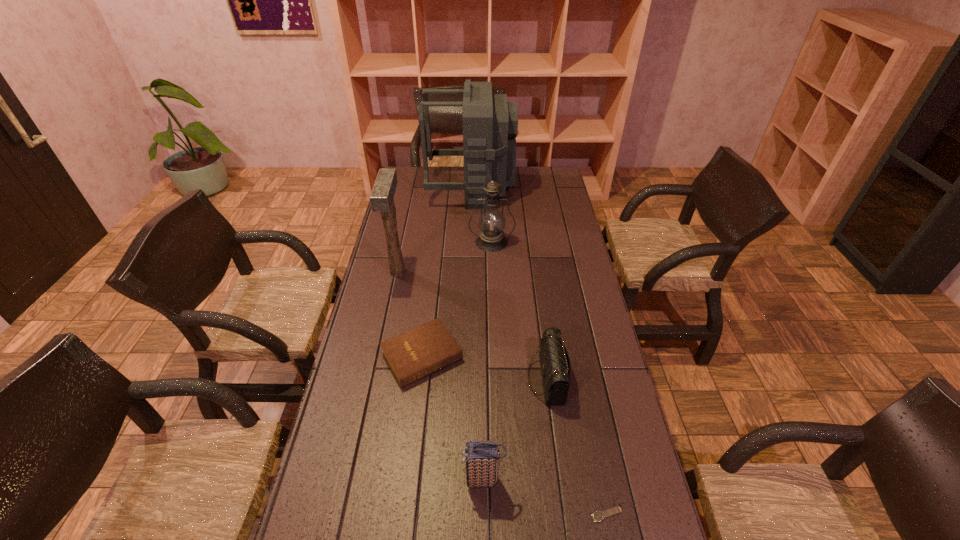
This screenshot has height=540, width=960. Find the location of `empty location between the nearer clutch bag and the second shortest object`. empty location between the nearer clutch bag and the second shortest object is located at coordinates pyautogui.click(x=453, y=418).

In order to click on blank region between the third shortest object and the sixth shortest object in this screenshot , I will do `click(472, 325)`.

At what (x,y) coordinates should I click in order to perform the action: click on free space between the watch and the right clutch bag. Please return your answer as a coordinate pair (x, y). Looking at the image, I should click on (577, 446).

Locate an element on the screen. This screenshot has width=960, height=540. vacant region between the shortest object and the taller clutch bag is located at coordinates (545, 497).

Select which object appears as the fifth closest to the shorter clutch bag. Please provide its 2D coordinates. Your answer should be formatted as a tuple, i.e. [(x, y)], where the tuple contains the x and y coordinates of a point satisfying the conditions above.

[(381, 198)]

Identify which object is the fourth closest to the shortest object. Please provide its 2D coordinates. Your answer should be formatted as a tuple, i.e. [(x, y)], where the tuple contains the x and y coordinates of a point satisfying the conditions above.

[(381, 198)]

At what (x,y) coordinates should I click in order to perform the action: click on free space that satisfies the following two spatial constraints: 1. with the zip open on the fourth shortest object; 2. on the right side of the nearest object. Please return your answer as a coordinate pair (x, y). The height and width of the screenshot is (540, 960). Looking at the image, I should click on (484, 514).

Identify the location of free point that satisfies the following two spatial constraints: 1. on the front side of the sixth nearest object; 2. with the zip open on the nearer clutch bag. (499, 480).

Identify the location of vacant point that satisfies the following two spatial constraints: 1. on the front side of the second farthest object; 2. on the left side of the nearest object. The width and height of the screenshot is (960, 540). [x=500, y=514].

Find the location of a particular element. The image size is (960, 540). vacant area in the image that satisfies the following two spatial constraints: 1. on the front side of the fifth shortest object; 2. with the zip open on the left clutch bag is located at coordinates 499,480.